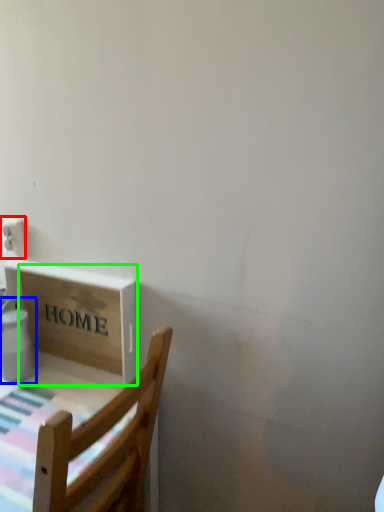
Question: Estimate the real-world distances between objects in this image. Which object is farther from electric outlet (highlighted by a red box), water heater (highlighted by a blue box) or cardboard box (highlighted by a green box)?

Choices:
 (A) water heater
 (B) cardboard box

Answer: (B)